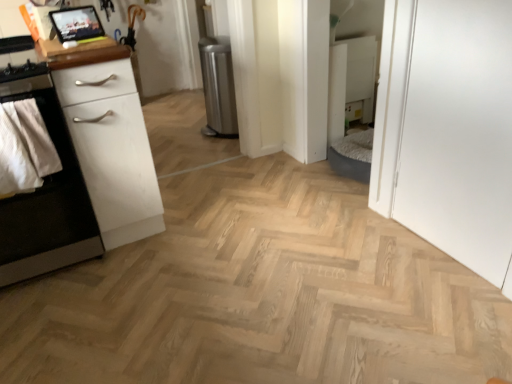
Find the location of a particular element. free space to the left of metallic trash can at center, the first appliance viewed from the right is located at coordinates (187, 128).